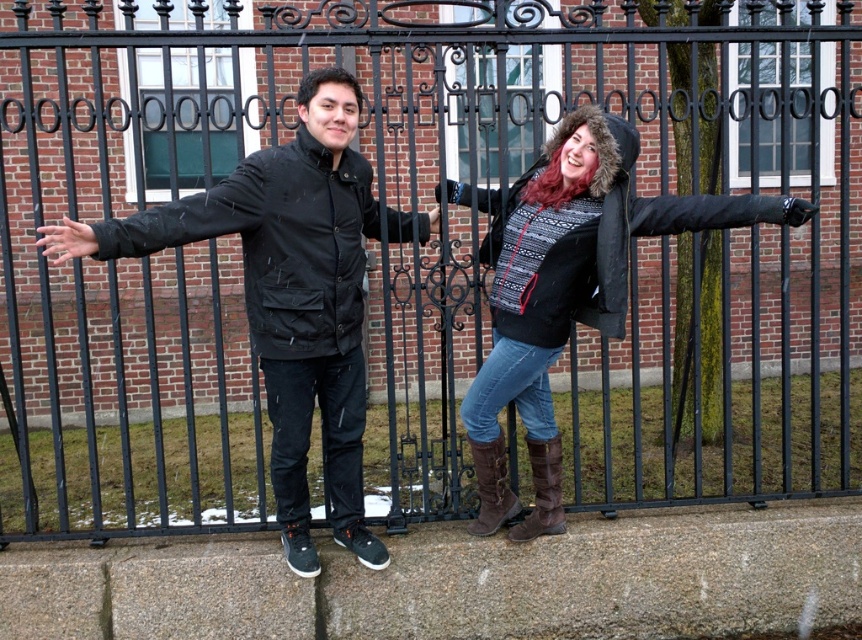
You are trying to decide which object is larger between the matte black jacket at left and the brown leather boot at lower center. Based on the scene, which one is bigger?

The matte black jacket at left is bigger than the brown leather boot at lower center according to the description.